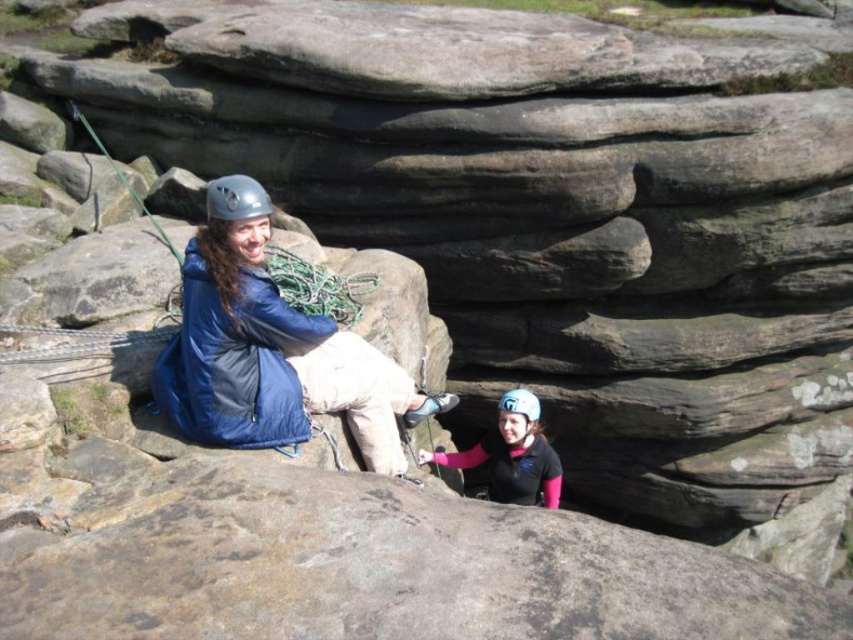
Is blue synthetic jacket at upper left below metallic gray helmet at upper center?

Indeed, blue synthetic jacket at upper left is positioned under metallic gray helmet at upper center.

Based on the photo, does blue synthetic jacket at upper left have a greater width compared to metallic gray helmet at upper center?

Yes, blue synthetic jacket at upper left is wider than metallic gray helmet at upper center.

The width and height of the screenshot is (853, 640). What are the coordinates of `blue synthetic jacket at upper left` in the screenshot? It's located at (271, 349).

Between point (432, 458) and point (523, 429), which one is positioned in front?

Point (523, 429) is more forward.

Is point (555, 484) behind point (527, 413)?

Yes, point (555, 484) is behind point (527, 413).

Identify the location of matte white helmet at center. pyautogui.click(x=512, y=454).

Does point (231, 180) come behind point (520, 490)?

No, (231, 180) is closer to viewer.

Does blue synthetic jacket at upper left lie behind matte white helmet at center?

No, it is not.

What do you see at coordinates (271, 349) in the screenshot? Image resolution: width=853 pixels, height=640 pixels. I see `blue synthetic jacket at upper left` at bounding box center [271, 349].

At what (x,y) coordinates should I click in order to perform the action: click on blue synthetic jacket at upper left. Please return your answer as a coordinate pair (x, y). This screenshot has height=640, width=853. Looking at the image, I should click on (271, 349).